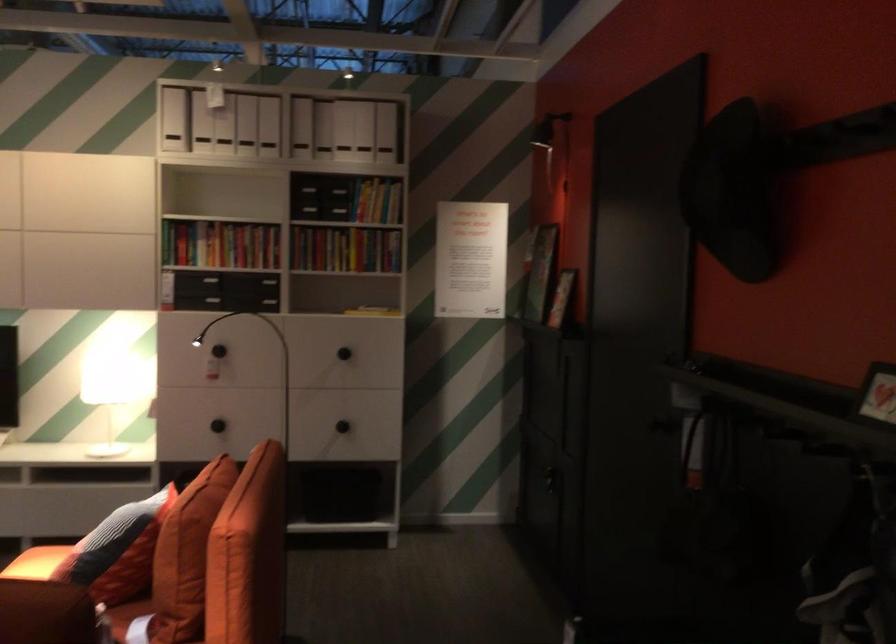
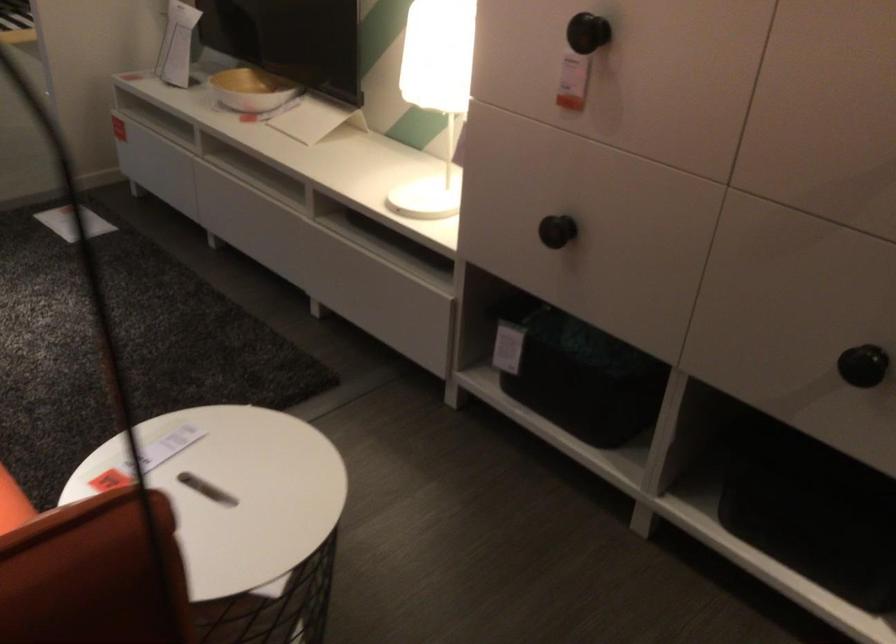
Locate, in the second image, the point that corresponds to point (340, 419) in the first image.

(863, 365)